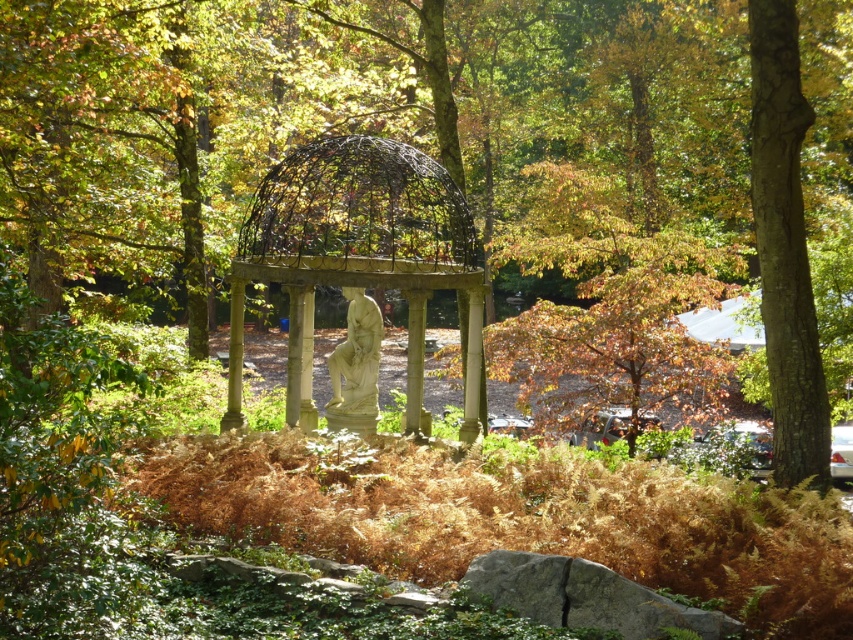
Question: Is matte black gazebo at center to the left of light beige stone statue at center from the viewer's perspective?

Choices:
 (A) yes
 (B) no

Answer: (A)

Question: Does matte black gazebo at center have a lesser width compared to green rough bark tree at right?

Choices:
 (A) no
 (B) yes

Answer: (B)

Question: Which of the following is the closest to the observer?

Choices:
 (A) green rough bark tree at right
 (B) white stone column at center
 (C) matte black gazebo at center

Answer: (A)

Question: Which point is closer to the camera?

Choices:
 (A) matte black gazebo at center
 (B) green rough bark tree at right
 (C) white stone column at center
 (D) light beige stone statue at center

Answer: (B)

Question: Which of the following is the closest to the observer?

Choices:
 (A) (413, 340)
 (B) (762, 100)
 (C) (370, 403)
 (D) (474, 328)

Answer: (B)

Question: From the image, what is the correct spatial relationship of green rough bark tree at right in relation to white stone column at center?

Choices:
 (A) right
 (B) left

Answer: (A)